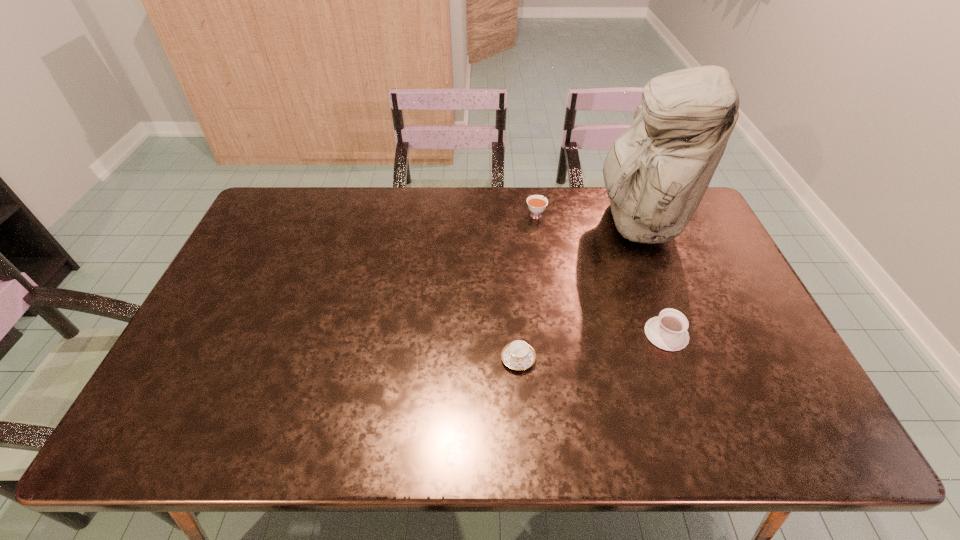
This screenshot has width=960, height=540. Identify the location of free space between the tallest object and the shortest object. (578, 291).

Image resolution: width=960 pixels, height=540 pixels. I want to click on free space between the tallest object and the leftmost teacup, so click(578, 291).

I want to click on free space between the rightmost teacup and the farthest teacup, so pos(601,274).

The height and width of the screenshot is (540, 960). What are the coordinates of `free spot between the second teacup from left to right and the backpack` in the screenshot? It's located at (587, 219).

Locate an element on the screen. The width and height of the screenshot is (960, 540). unoccupied area between the rightmost teacup and the backpack is located at coordinates (652, 279).

The image size is (960, 540). Identify the location of the closest object to the leftmost teacup. (668, 331).

Identify which object is the closest to the leftmost object. Please provide its 2D coordinates. Your answer should be formatted as a tuple, i.e. [(x, y)], where the tuple contains the x and y coordinates of a point satisfying the conditions above.

[(668, 331)]

The width and height of the screenshot is (960, 540). I want to click on teacup that stands as the second closest to the leftmost object, so (536, 204).

Identify which teacup is the second closest to the backpack. Please provide its 2D coordinates. Your answer should be formatted as a tuple, i.e. [(x, y)], where the tuple contains the x and y coordinates of a point satisfying the conditions above.

[(668, 331)]

Find the location of a particular element. The width and height of the screenshot is (960, 540). blank space that satisfies the following two spatial constraints: 1. on the front-facing side of the tallest object; 2. on the side with the handle of the shortest teacup is located at coordinates 691,359.